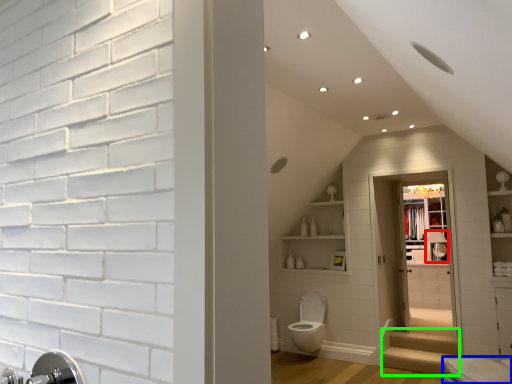
Question: Which object is the farthest from faucet (highlighted by a red box)? Choose among these: toilet (highlighted by a blue box) or stairwell (highlighted by a green box).

Choices:
 (A) toilet
 (B) stairwell

Answer: (A)